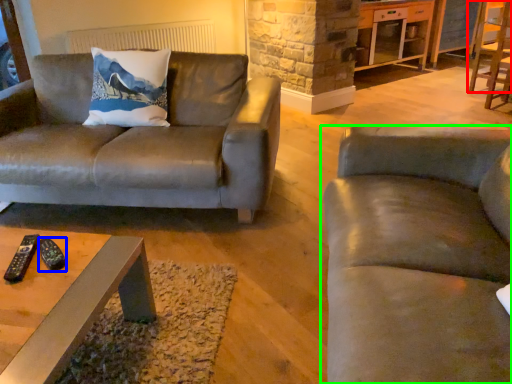
Question: Based on their relative distances, which object is farther from chair (highlighted by a red box)? Choose from remote (highlighted by a blue box) and studio couch (highlighted by a green box).

Choices:
 (A) remote
 (B) studio couch

Answer: (A)